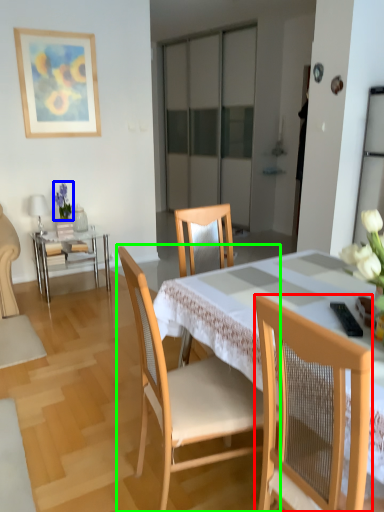
Question: Estimate the real-world distances between objects in this image. Which object is closer to chair (highlighted by a red box), floral arrangement (highlighted by a blue box) or chair (highlighted by a green box)?

Choices:
 (A) floral arrangement
 (B) chair

Answer: (B)